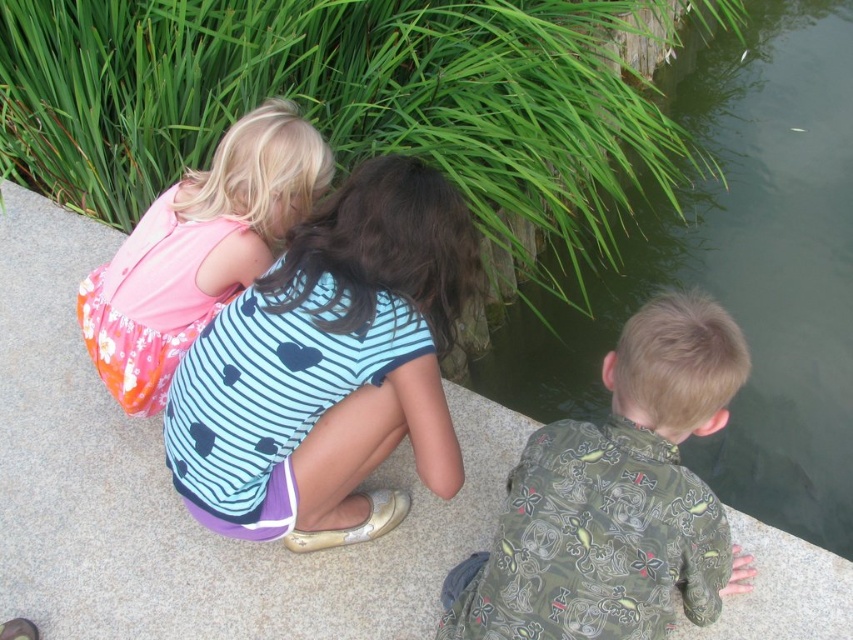
Question: Considering the relative positions of gray concrete ledge at center and camouflage-patterned shirt at lower right in the image provided, where is gray concrete ledge at center located with respect to camouflage-patterned shirt at lower right?

Choices:
 (A) above
 (B) below

Answer: (A)

Question: Which object appears closest to the camera in this image?

Choices:
 (A) camouflage-patterned shirt at lower right
 (B) gray concrete ledge at center

Answer: (A)

Question: Does camouflage-patterned shirt at lower right appear over pink fabric dress at upper left?

Choices:
 (A) yes
 (B) no

Answer: (B)

Question: Which object appears farthest from the camera in this image?

Choices:
 (A) pink fabric dress at upper left
 (B) camouflage-patterned shirt at lower right
 (C) blue striped shirt at center
 (D) green stone pond at lower right

Answer: (D)

Question: Estimate the real-world distances between objects in this image. Which object is closer to the camouflage-patterned shirt at lower right?

Choices:
 (A) pink fabric dress at upper left
 (B) blue striped shirt at center
 (C) gray concrete ledge at center

Answer: (B)

Question: Does green stone pond at lower right appear over blue striped shirt at center?

Choices:
 (A) no
 (B) yes

Answer: (B)